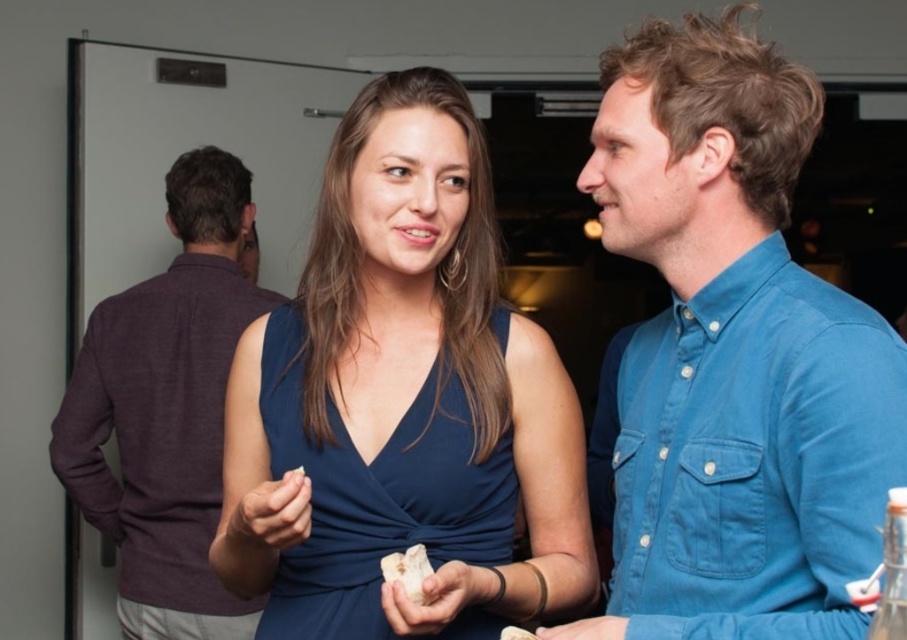
You are a photographer at the event and want to take a photo of the blue cotton shirt at upper right and the white crumbly bread at center. Which object should you focus on first if you want to capture both in the same frame without moving the camera?

The blue cotton shirt at upper right is positioned on the right side of white crumbly bread at center, so you should focus on the white crumbly bread at center first to ensure both are in the frame.

You are standing in the center of the room and see the point marked at coordinates [401,403]. What object is located at that point?

The point at coordinates [401,403] corresponds to the matte blue dress at center.